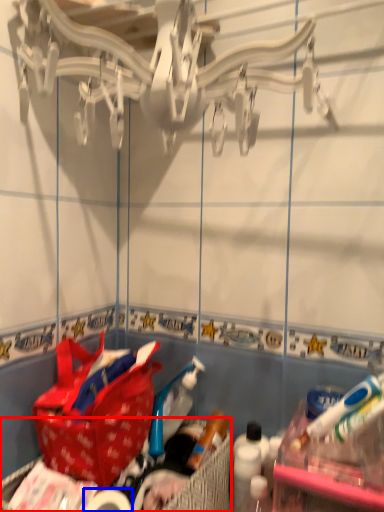
Question: Which of the following is the farthest to the observer, picnic basket (highlighted by a red box) or toilet paper (highlighted by a blue box)?

Choices:
 (A) picnic basket
 (B) toilet paper

Answer: (B)